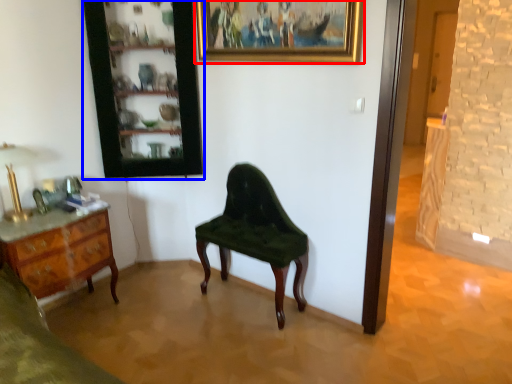
Question: Among these objects, which one is nearest to the camera, picture frame (highlighted by a red box) or cabinetry (highlighted by a blue box)?

Choices:
 (A) picture frame
 (B) cabinetry

Answer: (A)